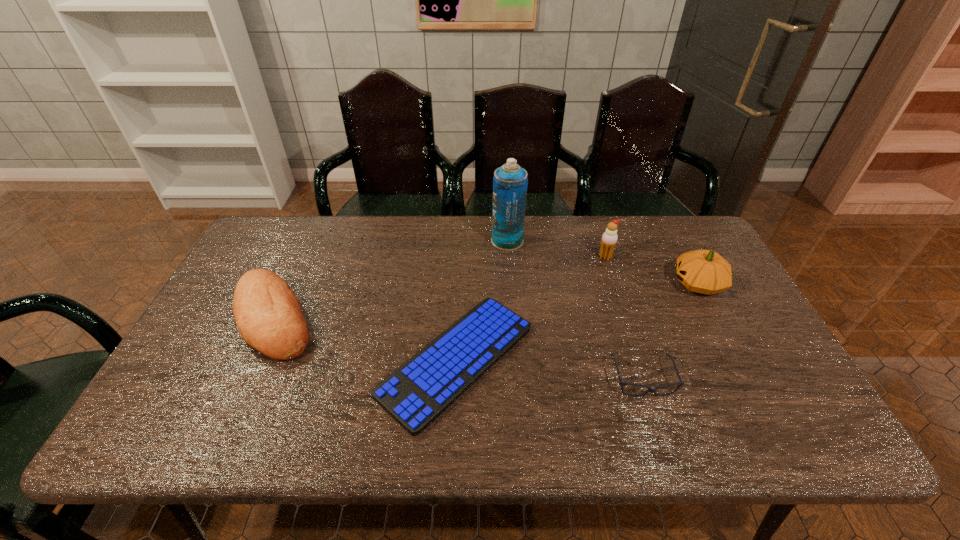
Locate an element on the screen. the farthest object is located at coordinates (510, 181).

This screenshot has height=540, width=960. Identify the location of the tallest object. (510, 181).

At what (x,y) coordinates should I click in order to perform the action: click on icecream. Please return your answer as a coordinate pair (x, y). Looking at the image, I should click on (609, 239).

Find the location of a particular element. The width and height of the screenshot is (960, 540). the third tallest object is located at coordinates (703, 271).

You are a GUI agent. You are given a task and a screenshot of the screen. Output one action in this format:
    pyautogui.click(x=<x>, y=<y>)
    Task: Click on the rightmost object
    The height and width of the screenshot is (540, 960).
    Given the screenshot: What is the action you would take?
    pyautogui.click(x=703, y=271)

This screenshot has height=540, width=960. What are the coordinates of `the fourth tallest object` in the screenshot? It's located at (269, 317).

This screenshot has width=960, height=540. What are the coordinates of `bread` in the screenshot? It's located at (269, 317).

The image size is (960, 540). In order to click on the second shortest object in this screenshot , I will do `click(622, 384)`.

Locate an element on the screen. The image size is (960, 540). the shortest object is located at coordinates [420, 390].

This screenshot has width=960, height=540. I want to click on vacant space located on the front of the tallest object, so click(x=514, y=333).